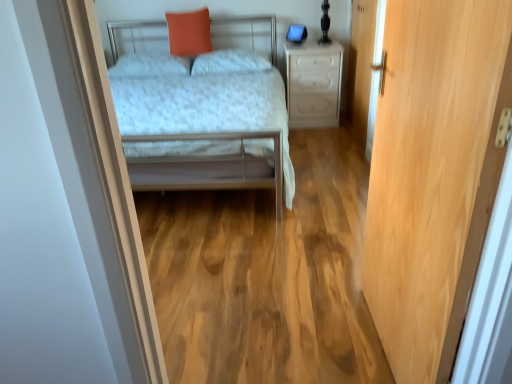
Find the location of `vacant space situated on the left part of light wood door at right`. vacant space situated on the left part of light wood door at right is located at coordinates (298, 335).